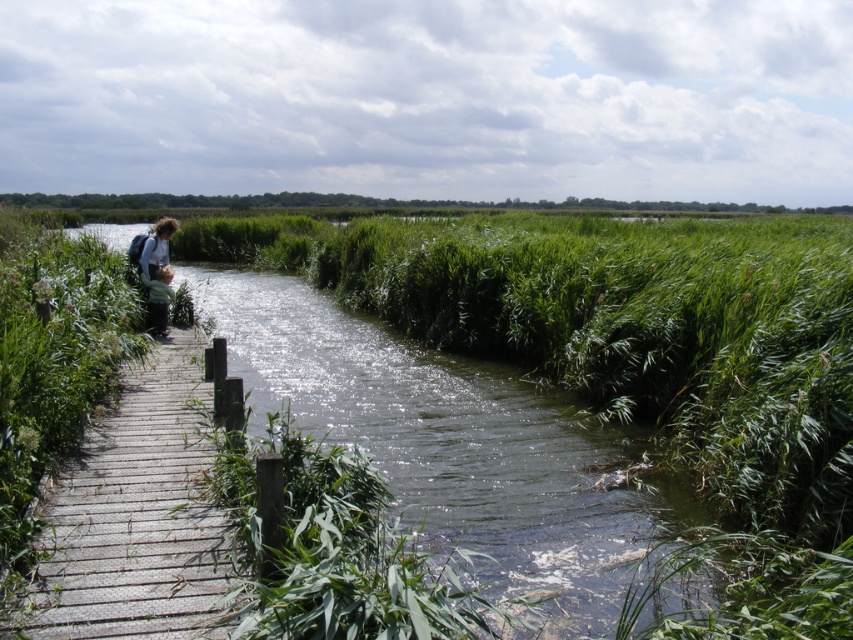
Question: Which object is closer to the camera taking this photo?

Choices:
 (A) light brown hair at left
 (B) light brown fabric child at left
 (C) wooden planks at left

Answer: (C)

Question: Is wooden planks at left further to camera compared to light brown hair at left?

Choices:
 (A) yes
 (B) no

Answer: (B)

Question: Does wooden planks at left appear over light brown hair at left?

Choices:
 (A) yes
 (B) no

Answer: (B)

Question: Based on their relative distances, which object is farther from the light brown hair at left?

Choices:
 (A) light brown fabric child at left
 (B) wooden planks at left

Answer: (B)

Question: Does wooden planks at left lie behind light brown hair at left?

Choices:
 (A) no
 (B) yes

Answer: (A)

Question: Which of these objects is positioned closest to the light brown hair at left?

Choices:
 (A) light brown fabric child at left
 (B) wooden planks at left

Answer: (A)